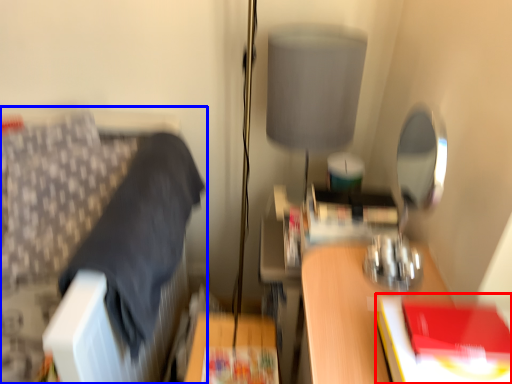
Question: Which point is closer to the camera, paperback book (highlighted by a red box) or furniture (highlighted by a blue box)?

Choices:
 (A) paperback book
 (B) furniture

Answer: (A)